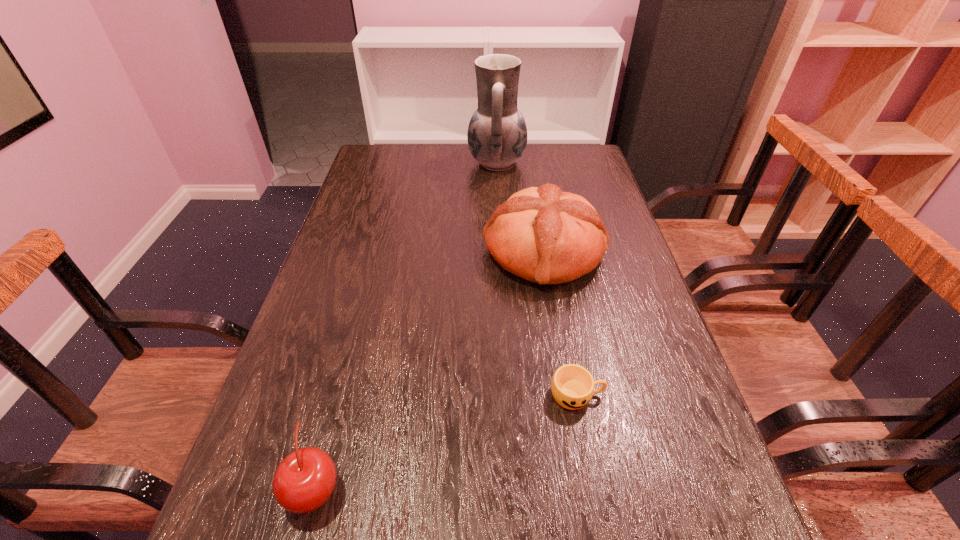
Find the location of `vacant area at the far right corner`. vacant area at the far right corner is located at coordinates (580, 148).

You are a GUI agent. You are given a task and a screenshot of the screen. Output one action in this format:
    pyautogui.click(x=<x>, y=<y>)
    Task: Click on the free space between the third nearest object and the shortest object
    
    Given the screenshot: What is the action you would take?
    pyautogui.click(x=560, y=323)

Find the location of a particular element. This screenshot has width=960, height=540. free space between the leftmost object and the second nearest object is located at coordinates (445, 441).

Identify the location of vacant point located between the third nearest object and the shortest object. This screenshot has width=960, height=540. (560, 323).

I want to click on vacant space that's between the third nearest object and the leftmost object, so click(429, 369).

Image resolution: width=960 pixels, height=540 pixels. What are the coordinates of `unoccupied area between the leftmost object and the shortest object` in the screenshot? It's located at (445, 441).

Image resolution: width=960 pixels, height=540 pixels. What are the coordinates of `vacant area that lies between the cherry and the farthest object` in the screenshot? It's located at (406, 325).

Identify the location of vacant area that lies between the third nearest object and the leftmost object. (429, 369).

The height and width of the screenshot is (540, 960). Find the location of `the closest object to the bread`. the closest object to the bread is located at coordinates (497, 134).

Point out which object is positioned as the third nearest to the pitcher. Please provide its 2D coordinates. Your answer should be formatted as a tuple, i.e. [(x, y)], where the tuple contains the x and y coordinates of a point satisfying the conditions above.

[(305, 479)]